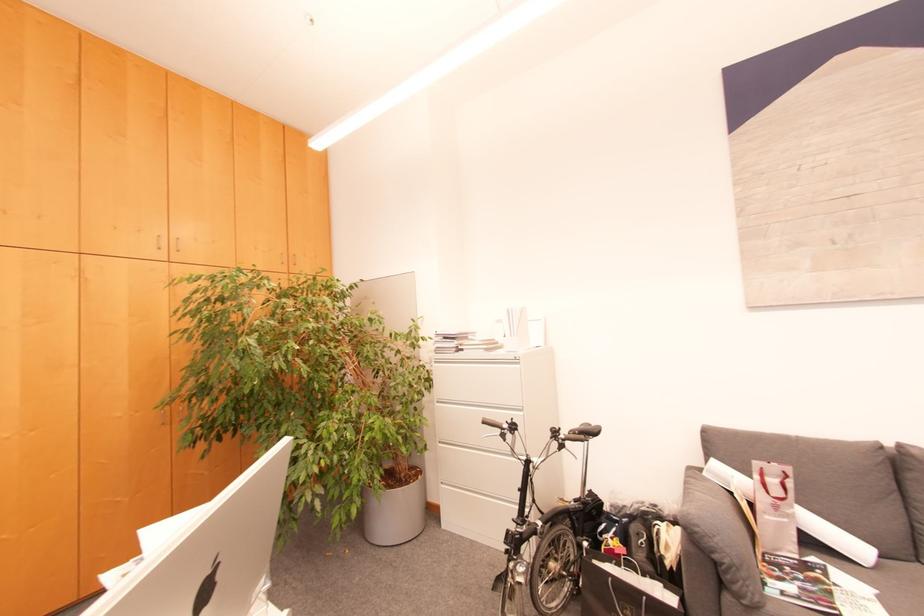
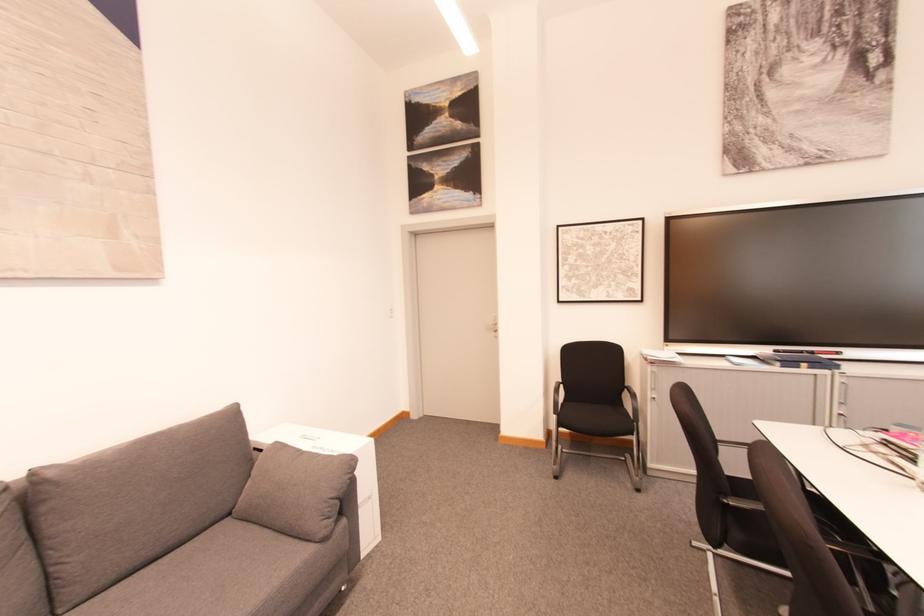
Question: The camera is either moving clockwise (left) or counter-clockwise (right) around the object. The first image is from the beginning of the video and the second image is from the end. Is the camera moving left or right when shooting the video?

Choices:
 (A) Left
 (B) Right

Answer: (A)